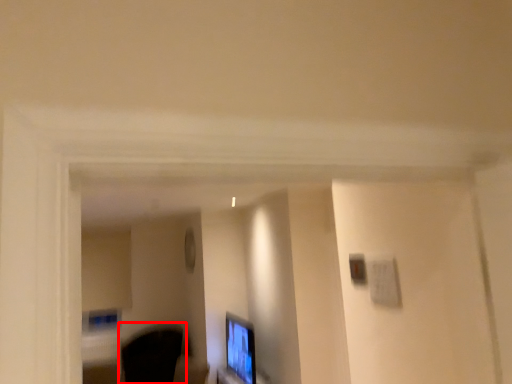
Question: From the image's perspective, considering the relative positions of swivel chair (annotated by the red box) and computer monitor in the image provided, where is swivel chair (annotated by the red box) located with respect to the staircase?

Choices:
 (A) below
 (B) above

Answer: (A)